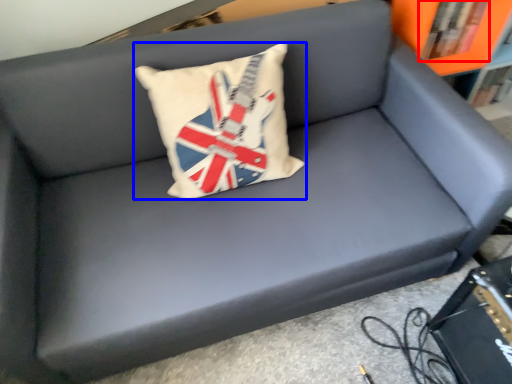
Question: Which of the following is the closest to the observer, book (highlighted by a red box) or pillow (highlighted by a blue box)?

Choices:
 (A) book
 (B) pillow

Answer: (B)